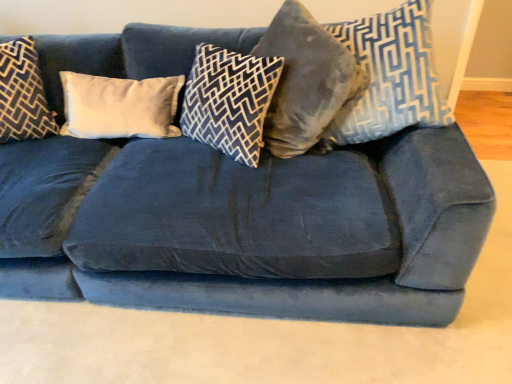
Question: Do you think velvet gray pillow at center, marked as the 2th pillow in a right-to-left arrangement, is within dark blue velvet pillow at left, which appears as the first pillow when viewed from the left, or outside of it?

Choices:
 (A) inside
 (B) outside

Answer: (B)

Question: Considering the positions of point (313, 51) and point (27, 110), is point (313, 51) closer or farther from the camera than point (27, 110)?

Choices:
 (A) farther
 (B) closer

Answer: (B)

Question: Estimate the real-world distances between objects in this image. Which object is closer to the dark blue velvet pillow at left, the 5th pillow in the right-to-left sequence?

Choices:
 (A) white velvet pillow at center, the 2th pillow from the left
 (B) velvet blue pillow at upper right, which appears as the first pillow when viewed from the right
 (C) velvet blue pillow at center, the third pillow from the right
 (D) velvet gray pillow at center, which ranks as the fourth pillow in left-to-right order

Answer: (A)

Question: Estimate the real-world distances between objects in this image. Which object is closer to the velvet blue pillow at upper right, which appears as the first pillow when viewed from the right?

Choices:
 (A) velvet gray pillow at center, which ranks as the fourth pillow in left-to-right order
 (B) white velvet pillow at center, which is counted as the fourth pillow, starting from the right
 (C) velvet blue pillow at center, the third pillow from the right
 (D) dark blue velvet pillow at left, the 5th pillow in the right-to-left sequence

Answer: (A)